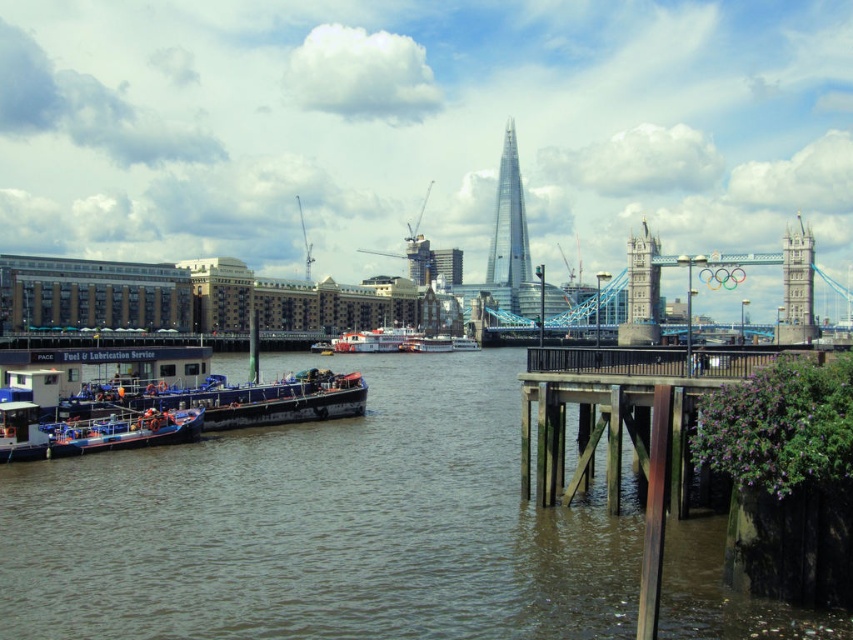
Can you confirm if stone tower at right is shorter than white plastic boat at center?

No.

The height and width of the screenshot is (640, 853). Describe the element at coordinates (798, 273) in the screenshot. I see `stone tower at right` at that location.

I want to click on stone tower at right, so coord(798,273).

Is brown water at lower left taller than stone tower at center?

In fact, brown water at lower left may be shorter than stone tower at center.

Image resolution: width=853 pixels, height=640 pixels. What are the coordinates of `brown water at lower left` in the screenshot? It's located at (323, 525).

At what (x,y) coordinates should I click in order to perform the action: click on brown water at lower left. Please return your answer as a coordinate pair (x, y). Looking at the image, I should click on (323, 525).

How much distance is there between stone tower at right and stone tower at center?

stone tower at right and stone tower at center are 27.05 meters apart from each other.

Based on the photo, who is more forward, (792, 243) or (646, 288)?

Point (792, 243) is more forward.

What are the coordinates of `stone tower at right` in the screenshot? It's located at (798, 273).